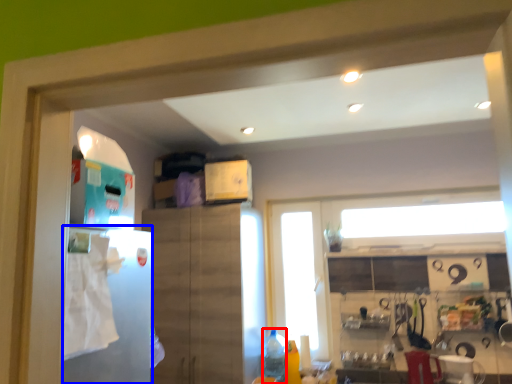
Question: Which of the following is the farthest to the observer, bottle (highlighted by a red box) or fridge (highlighted by a blue box)?

Choices:
 (A) bottle
 (B) fridge

Answer: (A)